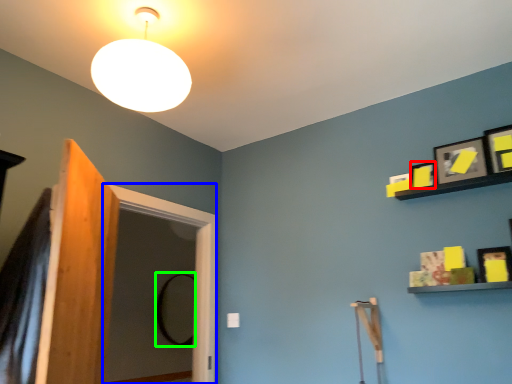
Question: Which is nearer to the picture frame (highlighted by a red box)? screen door (highlighted by a blue box) or mirror (highlighted by a green box).

Choices:
 (A) screen door
 (B) mirror

Answer: (A)